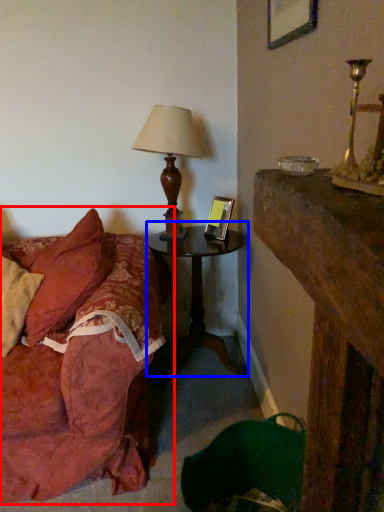
Question: Which object appears closest to the camera in this image, studio couch (highlighted by a red box) or nightstand (highlighted by a blue box)?

Choices:
 (A) studio couch
 (B) nightstand

Answer: (A)